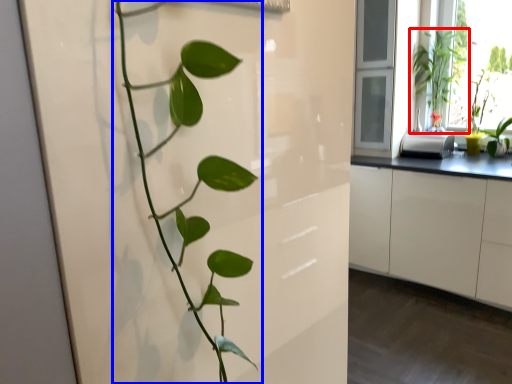
Question: Which object appears farthest to the camera in this image, houseplant (highlighted by a red box) or houseplant (highlighted by a blue box)?

Choices:
 (A) houseplant
 (B) houseplant

Answer: (A)